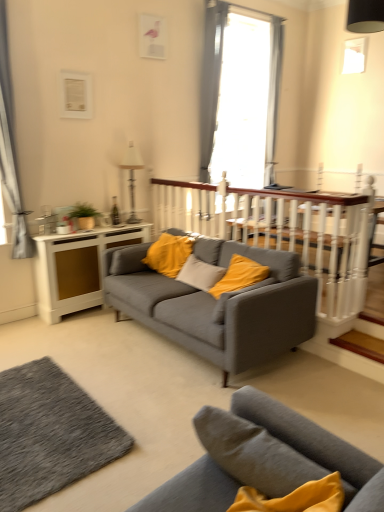
Question: Is white wooden balustrade at center at the right side of gray fabric curtain at upper center, which is the 2th curtain from front to back?

Choices:
 (A) no
 (B) yes

Answer: (B)

Question: Is white wooden balustrade at center thinner than gray fabric curtain at upper center, which appears as the 1th curtain when viewed from the right?

Choices:
 (A) yes
 (B) no

Answer: (A)

Question: Does white wooden balustrade at center have a greater width compared to gray fabric curtain at upper center, which appears as the 1th curtain when viewed from the right?

Choices:
 (A) no
 (B) yes

Answer: (A)

Question: Is white wooden balustrade at center facing away from gray fabric curtain at upper center, which appears as the 1th curtain when viewed from the right?

Choices:
 (A) no
 (B) yes

Answer: (A)

Question: From the image's perspective, does white wooden balustrade at center appear higher than gray fabric curtain at upper center, which is the 2th curtain from front to back?

Choices:
 (A) no
 (B) yes

Answer: (A)

Question: In terms of height, does matte gray couch at center, the second studio couch in the front-to-back sequence, look taller or shorter compared to gray fabric curtain at left, the second curtain positioned from the back?

Choices:
 (A) tall
 (B) short

Answer: (B)

Question: Looking at their shapes, would you say matte gray couch at center, the second studio couch in the front-to-back sequence, is wider or thinner than gray fabric curtain at left, the first curtain from the left?

Choices:
 (A) wide
 (B) thin

Answer: (A)

Question: In the image, is matte gray couch at center, which is the first studio couch from back to front, positioned in front of or behind gray fabric curtain at left, the second curtain positioned from the back?

Choices:
 (A) behind
 (B) front

Answer: (B)

Question: From the image's perspective, relative to gray fabric curtain at left, placed as the first curtain when sorted from front to back, is matte gray couch at center, which is the first studio couch from back to front, above or below?

Choices:
 (A) above
 (B) below

Answer: (B)

Question: From a real-world perspective, is white wooden balustrade at center above or below textured gray rug at lower left?

Choices:
 (A) above
 (B) below

Answer: (A)

Question: From the image's perspective, is white wooden balustrade at center positioned above or below textured gray rug at lower left?

Choices:
 (A) below
 (B) above

Answer: (B)

Question: Considering the positions of point (208, 216) and point (4, 426), is point (208, 216) closer or farther from the camera than point (4, 426)?

Choices:
 (A) farther
 (B) closer

Answer: (A)

Question: Considering the relative positions of white wooden balustrade at center and textured gray rug at lower left in the image provided, is white wooden balustrade at center to the left or to the right of textured gray rug at lower left?

Choices:
 (A) left
 (B) right

Answer: (B)

Question: Do you think white wooden balustrade at center is within white wood side table at left, or outside of it?

Choices:
 (A) outside
 (B) inside

Answer: (A)

Question: Considering the relative positions of white wooden balustrade at center and white wood side table at left in the image provided, is white wooden balustrade at center to the left or to the right of white wood side table at left?

Choices:
 (A) right
 (B) left

Answer: (A)